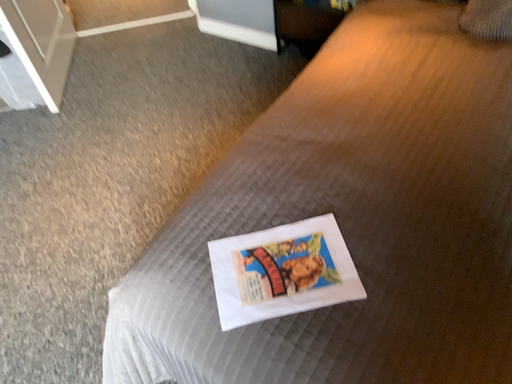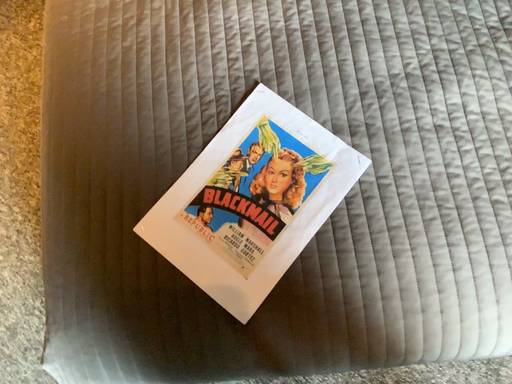
Question: How did the camera likely rotate when shooting the video?

Choices:
 (A) rotated upward
 (B) rotated downward

Answer: (B)